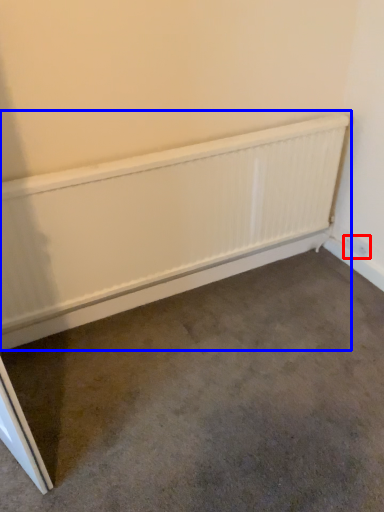
Question: Among these objects, which one is farthest to the camera, electric outlet (highlighted by a red box) or radiator (highlighted by a blue box)?

Choices:
 (A) electric outlet
 (B) radiator

Answer: (A)